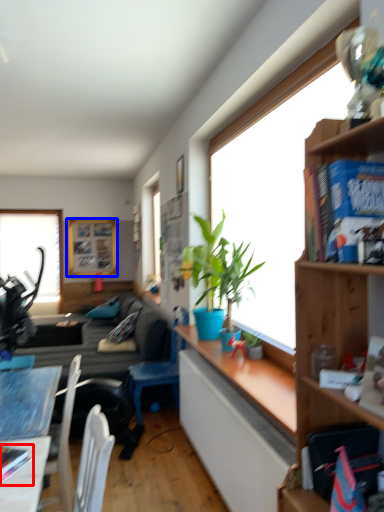
Question: Among these objects, which one is nearest to the camera, book (highlighted by a red box) or picture frame (highlighted by a blue box)?

Choices:
 (A) book
 (B) picture frame

Answer: (A)